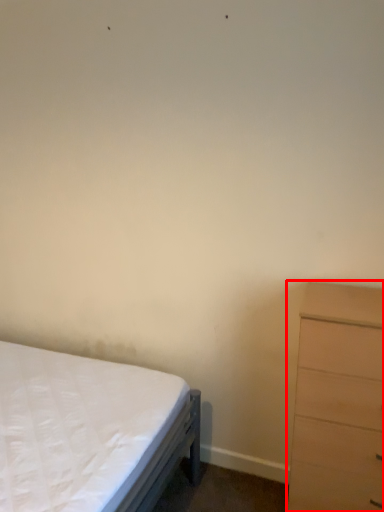
Question: From the image's perspective, what is the correct spatial relationship of chest of drawers (annotated by the red box) in relation to bed?

Choices:
 (A) below
 (B) above

Answer: (B)